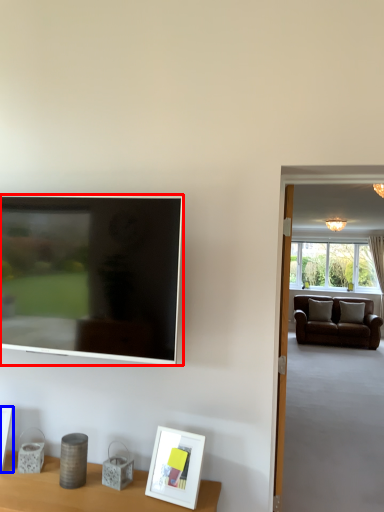
Question: Which of the following is the farthest to the observer, television (highlighted by a red box) or picture frame (highlighted by a blue box)?

Choices:
 (A) television
 (B) picture frame

Answer: (B)